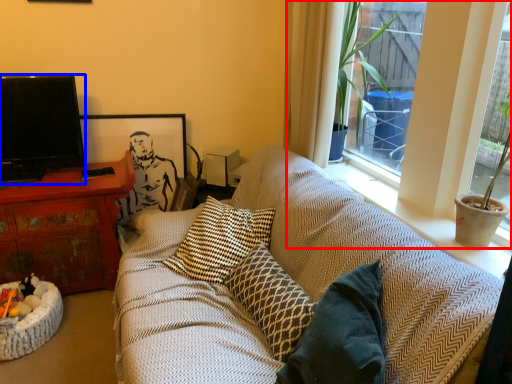
Question: Among these objects, which one is farthest to the camera, bay window (highlighted by a red box) or television (highlighted by a blue box)?

Choices:
 (A) bay window
 (B) television

Answer: (B)